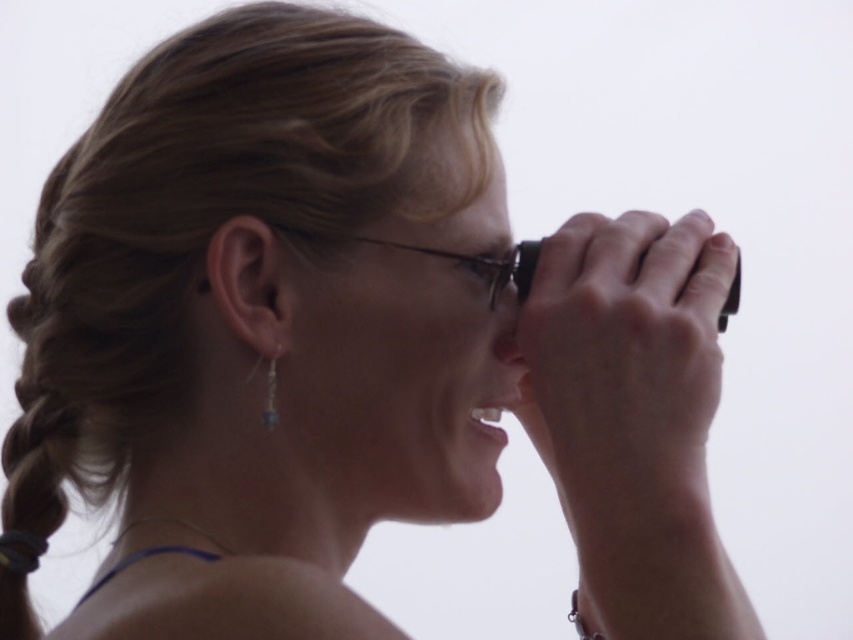
Is clear glass eye at center to the left of silver metallic earring at lower left from the viewer's perspective?

Incorrect, clear glass eye at center is not on the left side of silver metallic earring at lower left.

Is clear glass eye at center smaller than silver metallic earring at lower left?

Incorrect, clear glass eye at center is not smaller in size than silver metallic earring at lower left.

Find the location of `clear glass eye at center`. clear glass eye at center is located at coordinates (486, 268).

At what (x,y) coordinates should I click in order to perform the action: click on clear glass eye at center. Please return your answer as a coordinate pair (x, y). Looking at the image, I should click on (486, 268).